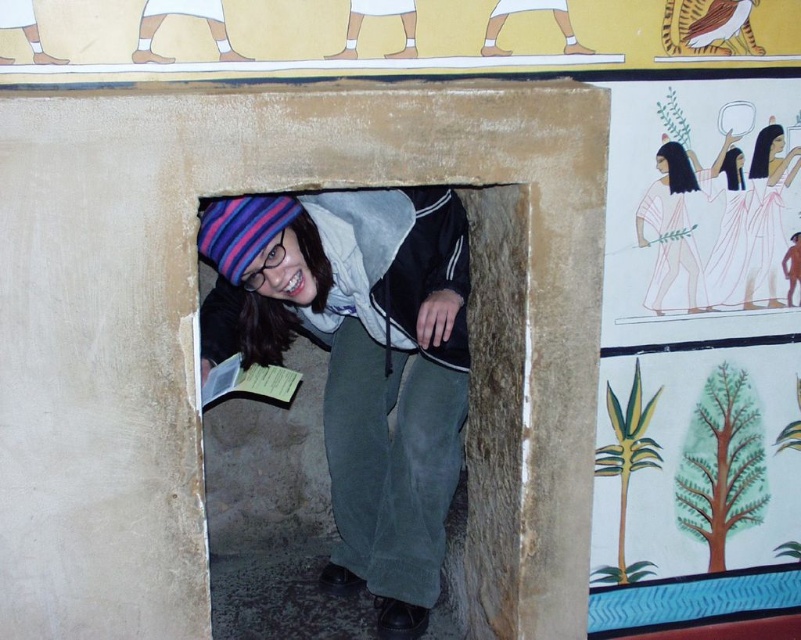
Question: Is smooth stone hole at center wider than smooth white dress at upper right?

Choices:
 (A) no
 (B) yes

Answer: (B)

Question: Which point is closer to the camera taking this photo?

Choices:
 (A) (759, 269)
 (B) (220, 262)

Answer: (B)

Question: Among these points, which one is farthest from the camera?

Choices:
 (A) (777, 154)
 (B) (272, 348)

Answer: (B)

Question: Can you confirm if smooth stone hole at center is thinner than smooth white dress at upper right?

Choices:
 (A) yes
 (B) no

Answer: (B)

Question: Is smooth stone hole at center bigger than smooth white dress at upper right?

Choices:
 (A) yes
 (B) no

Answer: (A)